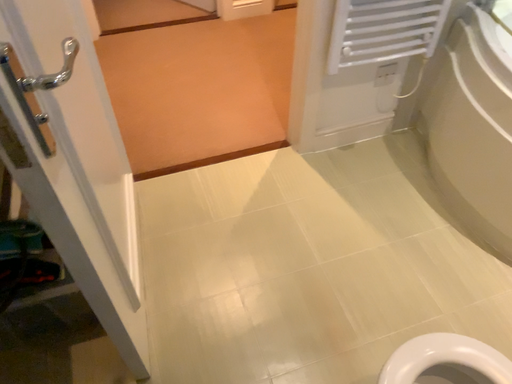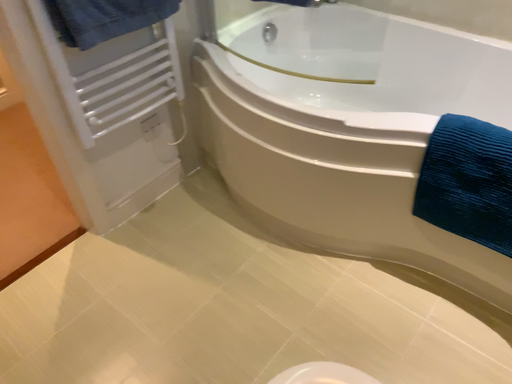
Question: Which way did the camera rotate in the video?

Choices:
 (A) rotated upward
 (B) rotated downward

Answer: (A)